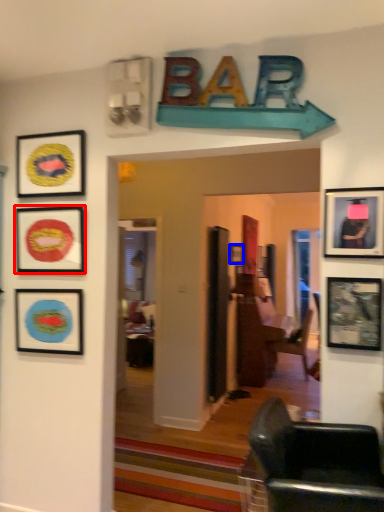
Question: Which of the following is the farthest to the observer, picture frame (highlighted by a red box) or picture frame (highlighted by a blue box)?

Choices:
 (A) picture frame
 (B) picture frame

Answer: (B)